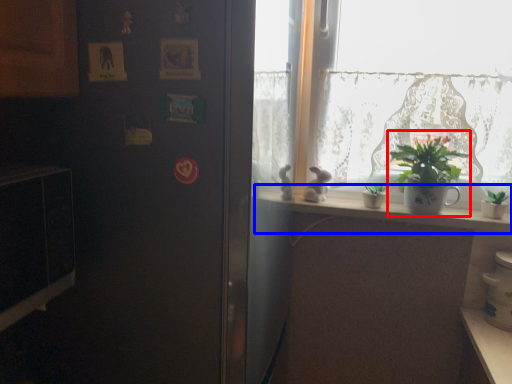
Question: Which object is further to the camera taking this photo, houseplant (highlighted by a red box) or window sill (highlighted by a blue box)?

Choices:
 (A) houseplant
 (B) window sill

Answer: (B)